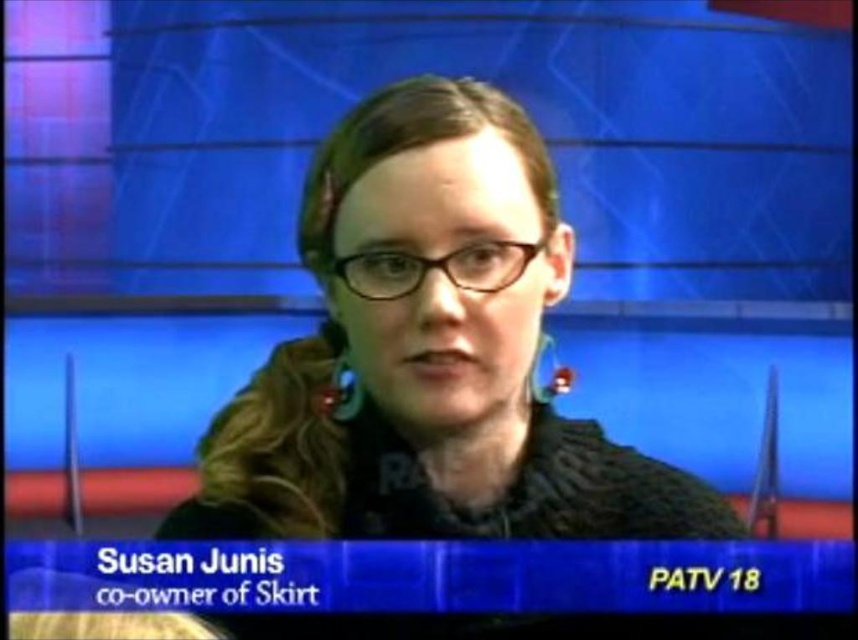
Question: Estimate the real-world distances between objects in this image. Which object is closer to the matte black glasses at center?

Choices:
 (A) green fabric earring at center
 (B) matte silver earring at center

Answer: (B)

Question: Considering the real-world distances, which object is closest to the green fabric earring at center?

Choices:
 (A) matte silver earring at center
 (B) black plastic glasses at center

Answer: (B)

Question: Can you confirm if black plastic glasses at center is positioned to the left of matte silver earring at center?

Choices:
 (A) no
 (B) yes

Answer: (A)

Question: Is black plastic glasses at center behind green fabric earring at center?

Choices:
 (A) yes
 (B) no

Answer: (B)

Question: Based on their relative distances, which object is nearer to the green fabric earring at center?

Choices:
 (A) black plastic glasses at center
 (B) matte silver earring at center
 (C) matte black glasses at center

Answer: (A)

Question: Does black plastic glasses at center have a smaller size compared to matte silver earring at center?

Choices:
 (A) no
 (B) yes

Answer: (A)